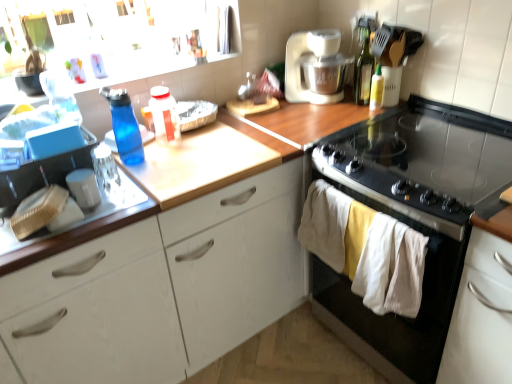
At what (x,y) coordinates should I click in order to perform the action: click on empty space that is ontop of black glass stove at right (from a real-world perspective). Please return your answer as a coordinate pair (x, y). The height and width of the screenshot is (384, 512). Looking at the image, I should click on (434, 146).